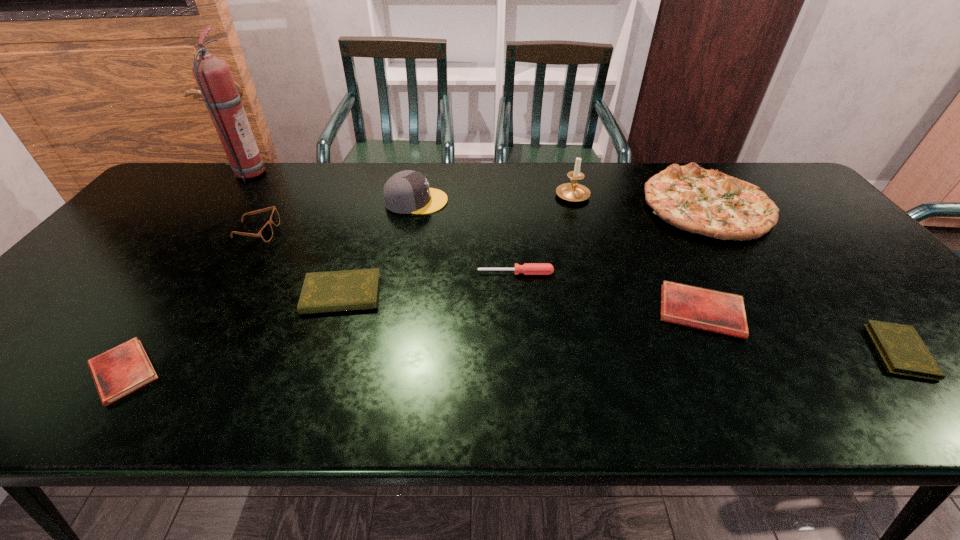
The width and height of the screenshot is (960, 540). I want to click on vacant area located 0.070m with a handle on the side of the beige candle holder, so click(566, 172).

At what (x,y) coordinates should I click in order to perform the action: click on vacant space located 0.140m with a handle on the side of the beige candle holder. Please return your answer as a coordinate pair (x, y). Looking at the image, I should click on (564, 163).

Locate an element on the screen. This screenshot has height=540, width=960. free space located with a handle on the side of the beige candle holder is located at coordinates (564, 167).

Locate an element on the screen. The height and width of the screenshot is (540, 960). blank space located 0.180m on the front-facing side of the gray cap is located at coordinates (505, 201).

Where is `vacant space situated on the left of the brown pizza`? Image resolution: width=960 pixels, height=540 pixels. vacant space situated on the left of the brown pizza is located at coordinates (621, 205).

The height and width of the screenshot is (540, 960). In order to click on free region located 0.320m on the frames of the sixth shortest object in this screenshot , I will do `click(388, 231)`.

Where is `vacant space located on the back of the red screwdriver`? Image resolution: width=960 pixels, height=540 pixels. vacant space located on the back of the red screwdriver is located at coordinates (509, 201).

The height and width of the screenshot is (540, 960). I want to click on vacant region located 0.380m on the right of the tallest diary, so click(x=538, y=294).

The image size is (960, 540). Identify the location of vacant space situated 0.270m on the back of the bigger red diary. [657, 221].

Image resolution: width=960 pixels, height=540 pixels. In order to click on blank space located 0.060m on the right of the rightmost diary in this screenshot , I will do `click(956, 351)`.